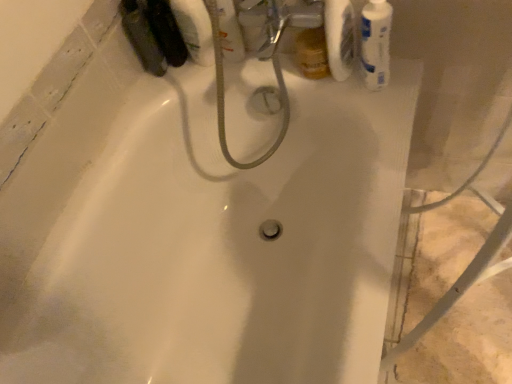
Locate an element on the screen. free space between clear plastic bottle at upper center, marked as the 2th mouthwash in a left-to-right arrangement, and matte black bottle at upper left, the 1th mouthwash in the left-to-right sequence is located at coordinates [x=194, y=60].